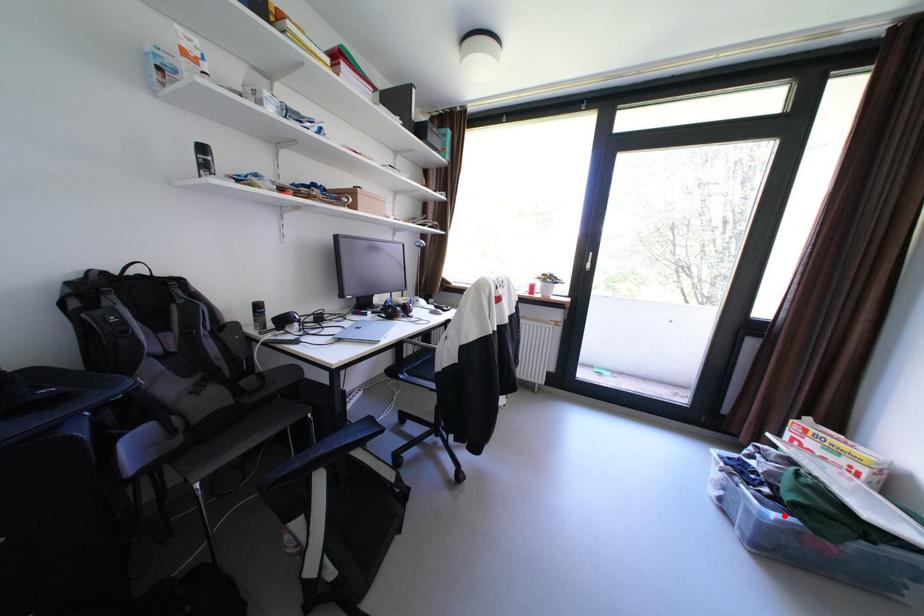
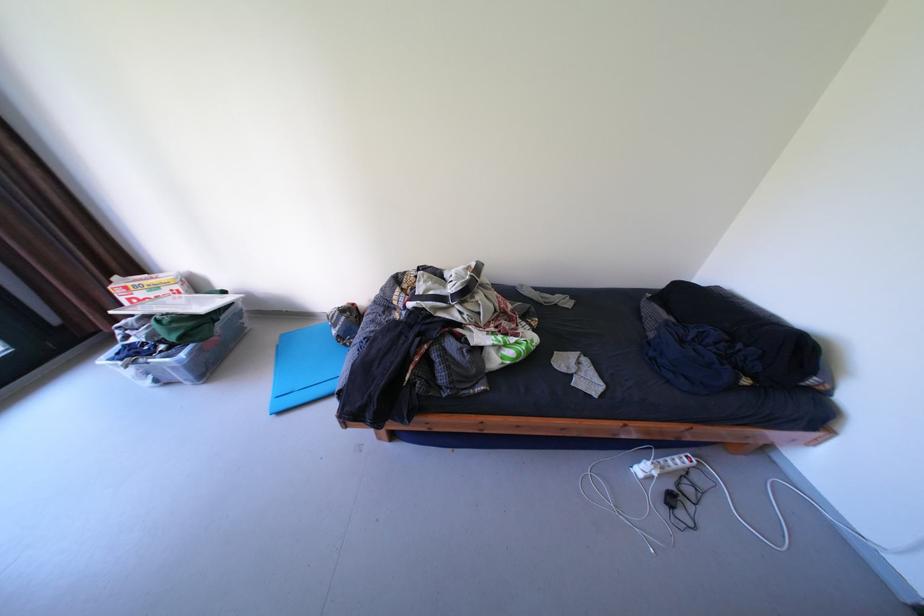
Locate, in the second image, the point that corresponds to the highlighted location in the first image.

(193, 355)